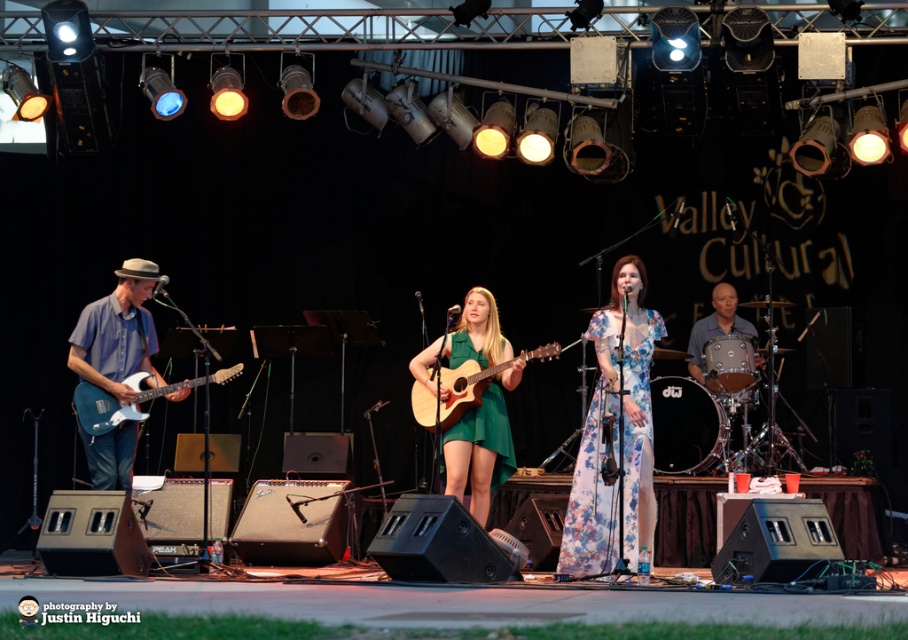
You are a photographer positioned at the back of the stage. You want to capture a photo where both the floral fabric dress at center and the blue matte electric guitar at left are in focus. Given that your camera can focus on objects within a 8 feet range, will you be able to achieve this?

The distance between the floral fabric dress at center and the blue matte electric guitar at left is 10.06 feet, which exceeds the camera focus range of 8 feet. Therefore, you won not be able to capture both in focus simultaneously.

You are a stage technician who needs to place a protective cover over both the natural wood acoustic guitar at center and the metallic blue electric guitar at left. Given that the cover you have is only large enough to fit the larger of the two guitars, which guitar should you use the cover for?

The natural wood acoustic guitar at center has a larger size compared to the metallic blue electric guitar at left, so the protective cover should be used for the natural wood acoustic guitar at center to ensure proper coverage.

You are a photographer at the Valley Cultural Festival. You want to capture a photo where the floral fabric dress at center and the blue matte electric guitar at left are both visible. Based on their positions, which one should appear higher in the photo?

The blue matte electric guitar at left appears higher than the floral fabric dress at center in the photo because the floral fabric dress at center is below the blue matte electric guitar at left.